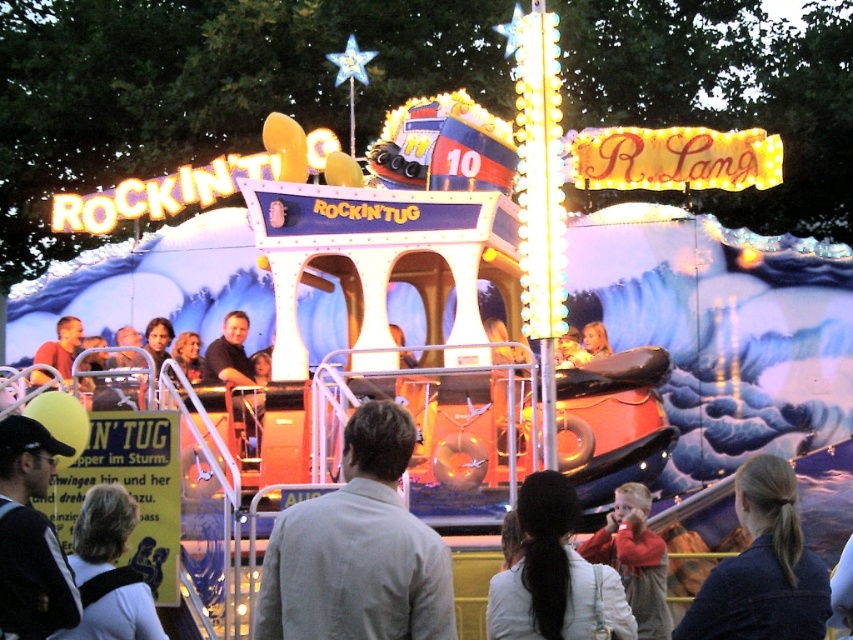
You are standing at the entrance of the fairground and see the RockinTug ride. There is a point at coordinate (358, 548) on the gray cotton shirt at center. If you walk straight towards the ride, will you pass through this point?

Yes, because the point is located on the gray cotton shirt at center, which is directly in front of you as you walk towards the RockinTug ride.